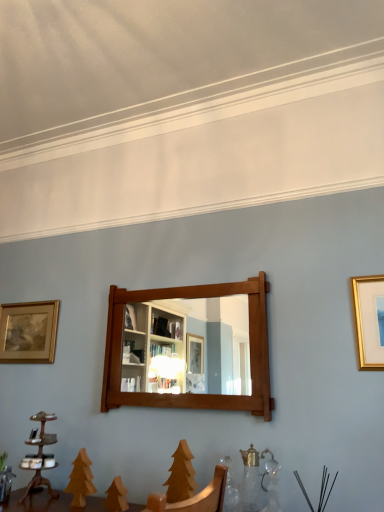
Question: From their relative heights in the image, would you say gold metallic picture frame at upper right, which appears as the first picture frame when viewed from the front, is taller or shorter than mahogany wooden mirror at center?

Choices:
 (A) tall
 (B) short

Answer: (B)

Question: Is point (359, 352) positioned closer to the camera than point (226, 304)?

Choices:
 (A) closer
 (B) farther

Answer: (A)

Question: Considering the real-world distances, which object is closest to the mahogany wooden mirror at center?

Choices:
 (A) gold metallic picture frame at upper right, the 1th picture frame in the right-to-left sequence
 (B) gold-framed painting at left, which is the second picture frame from right to left
 (C) wooden candle holder at lower left

Answer: (A)

Question: Estimate the real-world distances between objects in this image. Which object is closer to the wooden candle holder at lower left?

Choices:
 (A) gold-framed painting at left, the 1th picture frame in the back-to-front sequence
 (B) mahogany wooden mirror at center
 (C) gold metallic picture frame at upper right, the 1th picture frame in the right-to-left sequence

Answer: (A)